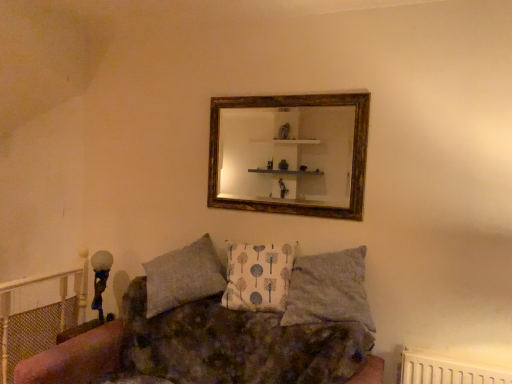
Describe the element at coordinates (328, 289) in the screenshot. I see `gray fabric pillow at center, which is the 1th pillow in right-to-left order` at that location.

Measure the distance between point (x=252, y=266) and camera.

Point (x=252, y=266) and camera are 2.17 meters apart from each other.

At what (x,y) coordinates should I click in order to perform the action: click on gray fabric pillow at center, which is the 1th pillow in right-to-left order. Please return your answer as a coordinate pair (x, y). Looking at the image, I should click on (328, 289).

Which of these two, white fabric pillow at center, positioned as the 1th pillow in left-to-right order, or textured fabric couch at center, is thinner?

white fabric pillow at center, positioned as the 1th pillow in left-to-right order, is thinner.

Are white fabric pillow at center, the second pillow positioned from the right, and textured fabric couch at center beside each other?

No, white fabric pillow at center, the second pillow positioned from the right, is not beside textured fabric couch at center.

From a real-world perspective, which object rests below the other?

textured fabric couch at center, from a real-world perspective.

Between white fabric pillow at center, the second pillow positioned from the right, and textured fabric couch at center, which one has more height?

textured fabric couch at center is taller.

Considering the sizes of white fabric pillow at center, positioned as the 1th pillow in left-to-right order, and gold-framed mirror at upper center in the image, is white fabric pillow at center, positioned as the 1th pillow in left-to-right order, wider or thinner than gold-framed mirror at upper center?

Considering their sizes, white fabric pillow at center, positioned as the 1th pillow in left-to-right order, looks broader than gold-framed mirror at upper center.

From the image's perspective, would you say white fabric pillow at center, positioned as the 1th pillow in left-to-right order, is shown under gold-framed mirror at upper center?

Indeed, from the image's perspective, white fabric pillow at center, positioned as the 1th pillow in left-to-right order, is shown beneath gold-framed mirror at upper center.

I want to click on mirror above the white fabric pillow at center, the second pillow positioned from the right (from the image's perspective), so click(x=287, y=155).

Considering the sizes of objects white fabric pillow at center, the second pillow positioned from the right, and gold-framed mirror at upper center in the image provided, who is shorter, white fabric pillow at center, the second pillow positioned from the right, or gold-framed mirror at upper center?

white fabric pillow at center, the second pillow positioned from the right, is shorter.

Is textured fabric couch at center next to white fabric pillow at center, positioned as the 1th pillow in left-to-right order?

No.

Based on the photo, can you confirm if textured fabric couch at center is shorter than white fabric pillow at center, the second pillow positioned from the right?

In fact, textured fabric couch at center may be taller than white fabric pillow at center, the second pillow positioned from the right.

Where is `studio couch in front of the white fabric pillow at center, the second pillow positioned from the right`? studio couch in front of the white fabric pillow at center, the second pillow positioned from the right is located at coordinates (74, 358).

Does gray fabric pillow at center, which is the 1th pillow in right-to-left order, have a smaller size compared to textured fabric couch at center?

Yes.

Would you say gray fabric pillow at center, which is the 1th pillow in right-to-left order, is inside or outside textured fabric couch at center?

gray fabric pillow at center, which is the 1th pillow in right-to-left order, exists outside the volume of textured fabric couch at center.

Is gray fabric pillow at center, the second pillow in the left-to-right sequence, wider than textured fabric couch at center?

No.

Considering the positions of objects gray fabric pillow at center, which is the 1th pillow in right-to-left order, and textured fabric couch at center in the image provided, who is in front, gray fabric pillow at center, which is the 1th pillow in right-to-left order, or textured fabric couch at center?

textured fabric couch at center is closer to the camera.

From the image's perspective, which one is positioned higher, gray fabric pillow at center, which is the 1th pillow in right-to-left order, or white fabric pillow at center, the second pillow positioned from the right?

From the image's view, white fabric pillow at center, the second pillow positioned from the right, is above.

Considering the points (315, 257) and (275, 295), which point is behind, point (315, 257) or point (275, 295)?

The point (315, 257) is farther from the camera.

Are gray fabric pillow at center, which is the 1th pillow in right-to-left order, and white fabric pillow at center, the second pillow positioned from the right, making contact?

No.

Does gray fabric pillow at center, the second pillow in the left-to-right sequence, turn towards white fabric pillow at center, positioned as the 1th pillow in left-to-right order?

No, gray fabric pillow at center, the second pillow in the left-to-right sequence, does not turn towards white fabric pillow at center, positioned as the 1th pillow in left-to-right order.

Is textured fabric couch at center situated inside gray fabric pillow at center, the second pillow in the left-to-right sequence, or outside?

textured fabric couch at center is located beyond the bounds of gray fabric pillow at center, the second pillow in the left-to-right sequence.

Who is shorter, textured fabric couch at center or gray fabric pillow at center, the second pillow in the left-to-right sequence?

gray fabric pillow at center, the second pillow in the left-to-right sequence, is shorter.

Does textured fabric couch at center turn towards gray fabric pillow at center, the second pillow in the left-to-right sequence?

No, textured fabric couch at center does not turn towards gray fabric pillow at center, the second pillow in the left-to-right sequence.

In the scene shown: Is gold-framed mirror at upper center far away from white fabric pillow at center, the second pillow positioned from the right?

Actually, gold-framed mirror at upper center and white fabric pillow at center, the second pillow positioned from the right, are a little close together.

Is gold-framed mirror at upper center positioned with its back to white fabric pillow at center, the second pillow positioned from the right?

No, gold-framed mirror at upper center is not facing away from white fabric pillow at center, the second pillow positioned from the right.

From the image's perspective, is gold-framed mirror at upper center beneath white fabric pillow at center, the second pillow positioned from the right?

Actually, gold-framed mirror at upper center appears above white fabric pillow at center, the second pillow positioned from the right, in the image.

This screenshot has width=512, height=384. What are the coordinates of `the 2nd pillow directly above the textured fabric couch at center (from a real-world perspective)` in the screenshot? It's located at (258, 276).

The height and width of the screenshot is (384, 512). Identify the location of the 1st pillow in front of the gold-framed mirror at upper center, starting your count from the anchor. (258, 276).

When comparing their distances from gray fabric pillow at center, the second pillow in the left-to-right sequence, does textured fabric couch at center or white fabric pillow at center, positioned as the 1th pillow in left-to-right order, seem further?

Based on the image, textured fabric couch at center appears to be further to gray fabric pillow at center, the second pillow in the left-to-right sequence.

Looking at the image, which one is located closer to gold-framed mirror at upper center, gray fabric pillow at center, the second pillow in the left-to-right sequence, or textured fabric couch at center?

The object closer to gold-framed mirror at upper center is gray fabric pillow at center, the second pillow in the left-to-right sequence.

Looking at the image, which one is located closer to gold-framed mirror at upper center, textured fabric couch at center or gray fabric pillow at center, the second pillow in the left-to-right sequence?

The object closer to gold-framed mirror at upper center is gray fabric pillow at center, the second pillow in the left-to-right sequence.

Which object lies further to the anchor point white fabric pillow at center, the second pillow positioned from the right, gray fabric pillow at center, which is the 1th pillow in right-to-left order, or gold-framed mirror at upper center?

Among the two, gold-framed mirror at upper center is located further to white fabric pillow at center, the second pillow positioned from the right.

Considering their positions, is gold-framed mirror at upper center positioned further to textured fabric couch at center than white fabric pillow at center, positioned as the 1th pillow in left-to-right order?

gold-framed mirror at upper center is positioned further to the anchor textured fabric couch at center.

Based on their spatial positions, is white fabric pillow at center, the second pillow positioned from the right, or gray fabric pillow at center, the second pillow in the left-to-right sequence, closer to gold-framed mirror at upper center?

The object closer to gold-framed mirror at upper center is white fabric pillow at center, the second pillow positioned from the right.

Considering their positions, is textured fabric couch at center positioned further to gold-framed mirror at upper center than white fabric pillow at center, the second pillow positioned from the right?

Based on the image, textured fabric couch at center appears to be further to gold-framed mirror at upper center.

Based on their spatial positions, is gold-framed mirror at upper center or gray fabric pillow at center, the second pillow in the left-to-right sequence, further from textured fabric couch at center?

gold-framed mirror at upper center lies further to textured fabric couch at center than the other object.

Locate an element on the screen. The height and width of the screenshot is (384, 512). pillow located between textured fabric couch at center and white fabric pillow at center, the second pillow positioned from the right, in the depth direction is located at coordinates (328, 289).

Find the location of a particular element. pillow that lies between gold-framed mirror at upper center and gray fabric pillow at center, the second pillow in the left-to-right sequence, from top to bottom is located at coordinates (258, 276).